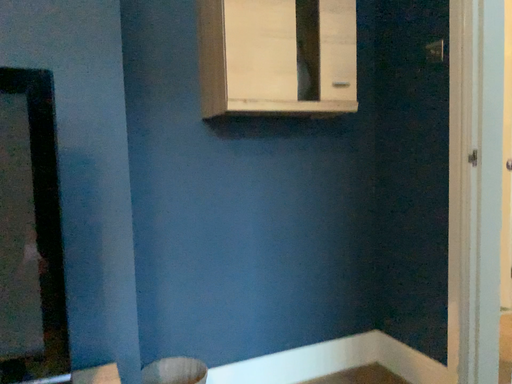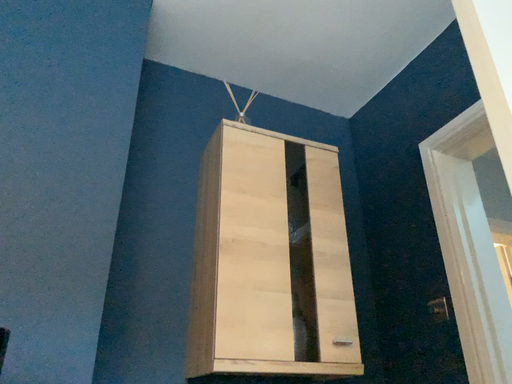
Question: Which way did the camera rotate in the video?

Choices:
 (A) rotated upward
 (B) rotated downward

Answer: (A)